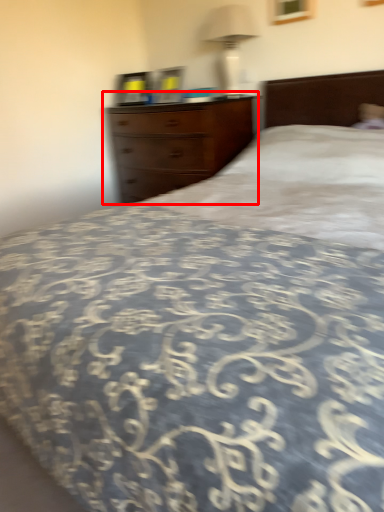
Question: Where is chest of drawers (annotated by the red box) located in relation to bedside lamp in the image?

Choices:
 (A) left
 (B) right

Answer: (A)